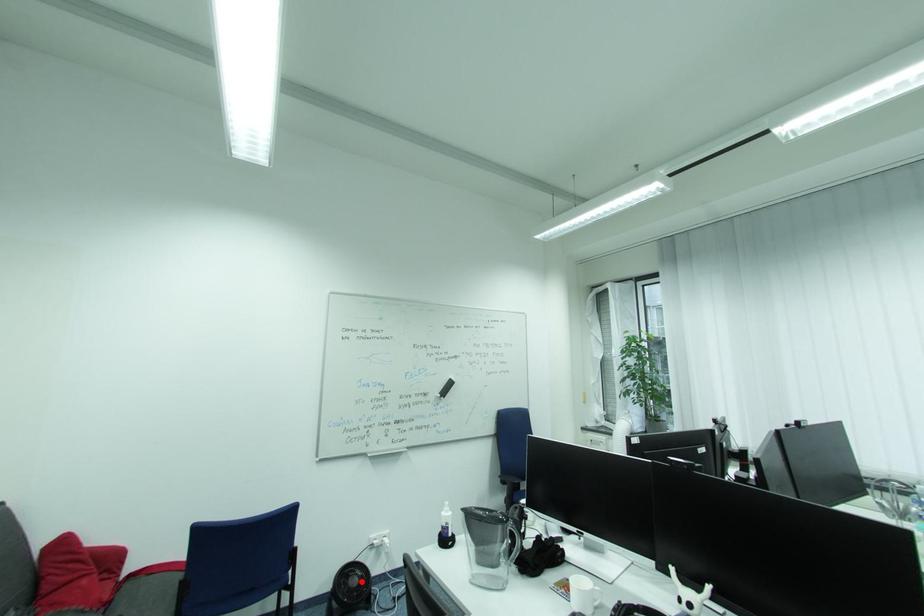
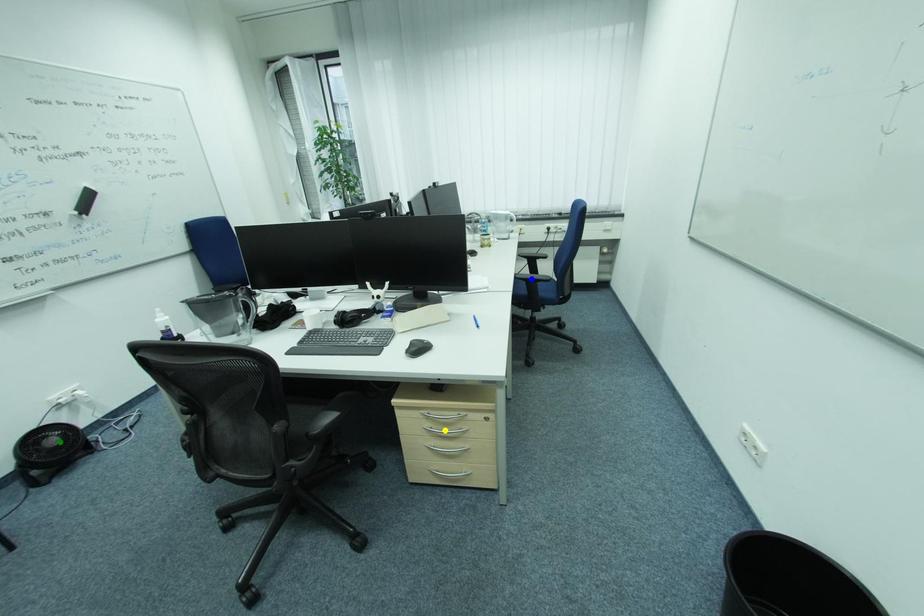
Question: I am providing you with two images of the same scene from different viewpoints. A red point is marked on the first image. You are given multiple points on the second image. Which point in image 2 represents the same 3d spot as the red point in image 1?

Choices:
 (A) green point
 (B) yellow point
 (C) blue point

Answer: (A)